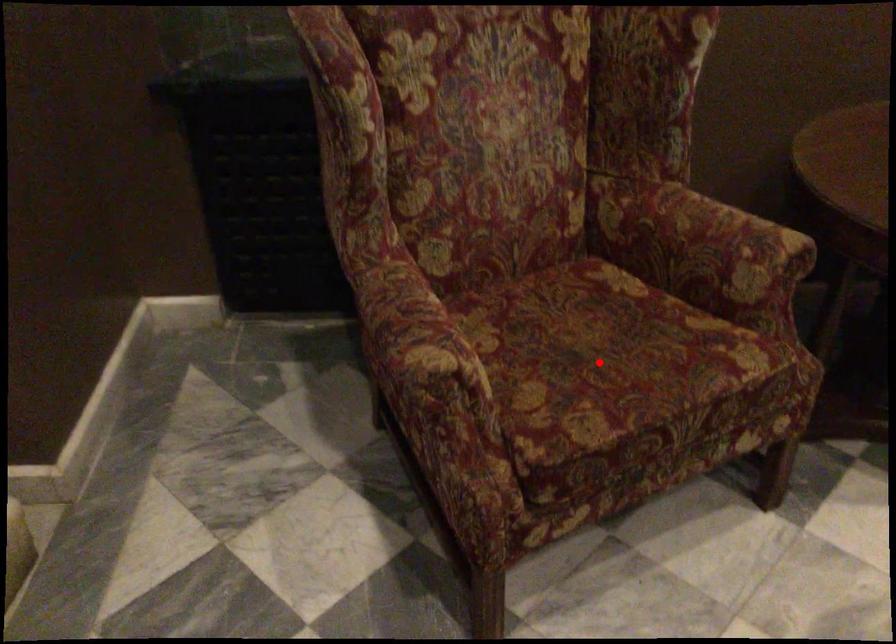
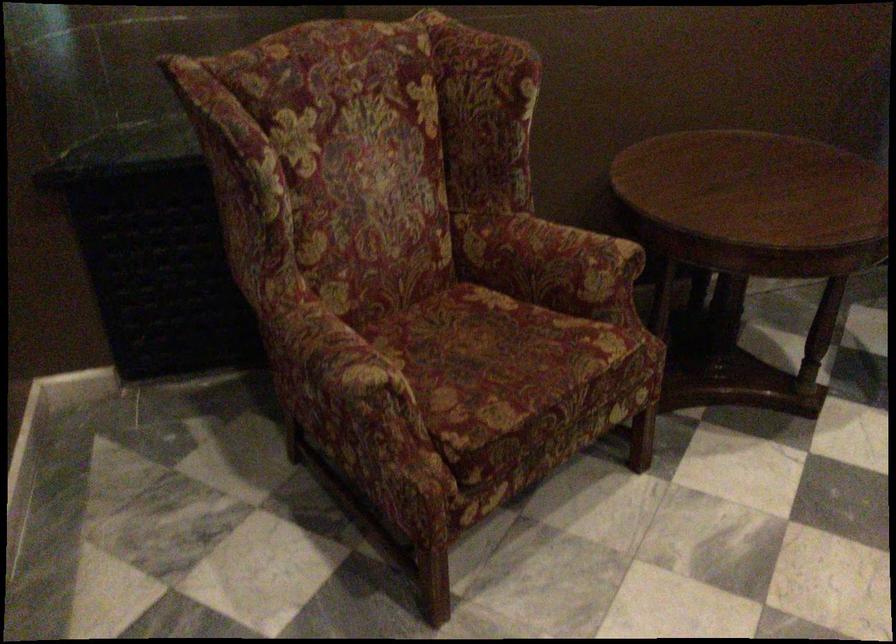
Where in the second image is the point corresponding to the highlighted location from the first image?

(495, 363)